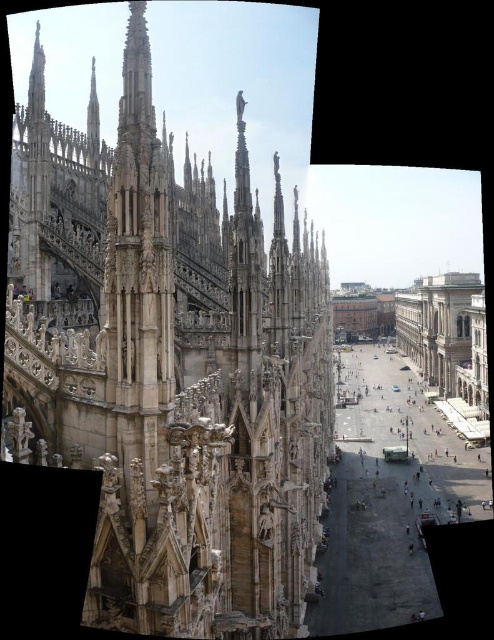
You are standing in front of the cathedral and want to take a photo that includes both point [181,442] and point [474,333]. Since you want both points to be clearly visible, which point should you focus on to ensure the one farther away is still in focus?

You should focus on point [474,333] because it is farther from the camera than point [181,442]. By focusing on the farther point, the closer point will also be within the depth of field, ensuring both are in focus.

You are standing in front of the cathedral and want to know how far the point at coordinates point (209, 604) is from you. Can you determine the distance?

The point (209, 604) is 64.88 meters away from the viewer.

You are a tourist standing in the piazza in front of the cathedral. You want to take a photo that includes both the stone gothic cathedral at center and the beige stone building at right. Which building should you position closer to the camera to ensure both are in frame?

You should position the stone gothic cathedral at center closer to the camera because it is in front of the beige stone building at right, so keeping it closer will allow both to be captured in the photo.